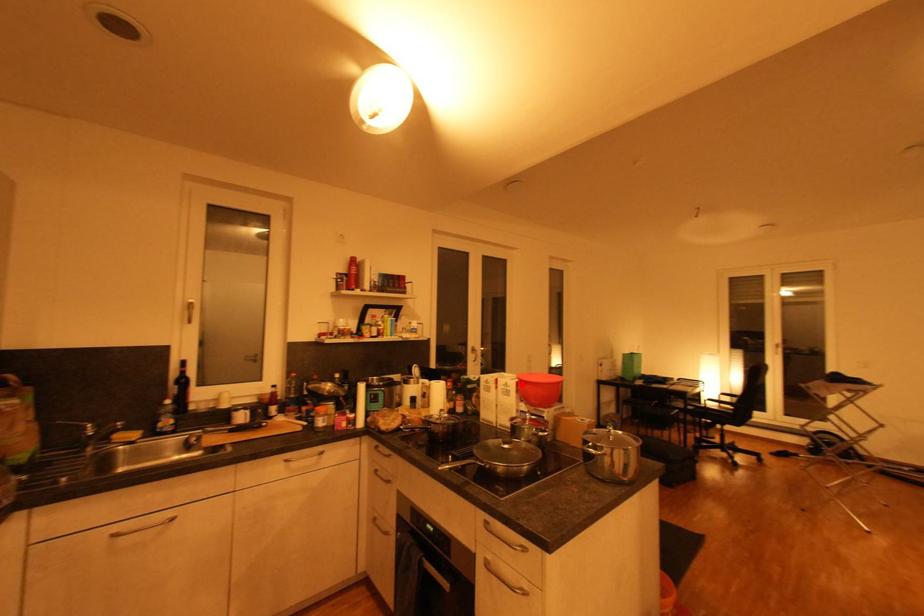
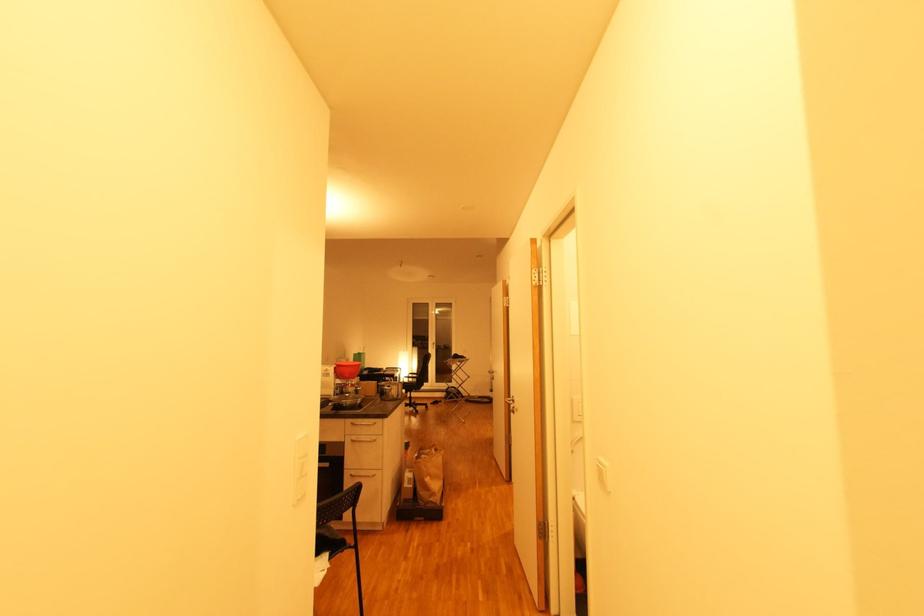
Where in the second image is the point corresponding to the highlighted location from the first image?

(339, 369)